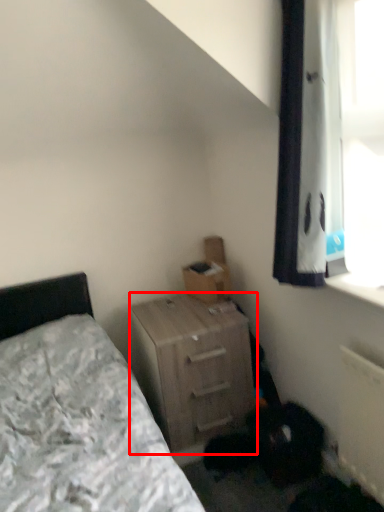
Question: From the image's perspective, where is nightstand (annotated by the red box) located in relation to cardboard box in the image?

Choices:
 (A) above
 (B) below

Answer: (B)